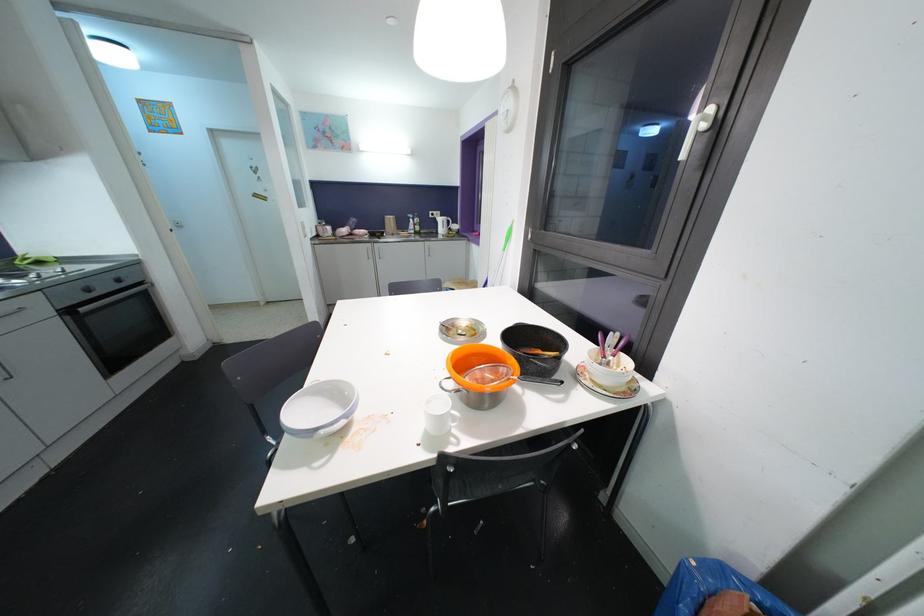
Find where to pull the white window handle. Please return your answer as a coordinate pair (x, y).

(697, 129)